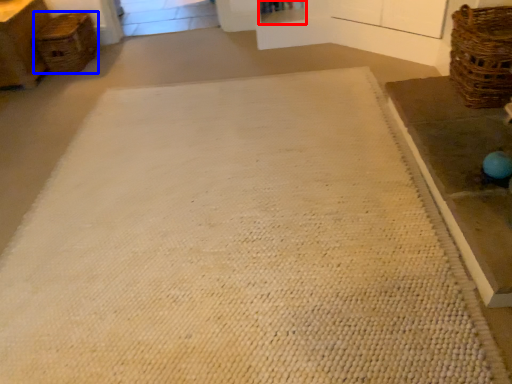
Question: Which object is further to the camera taking this photo, shelf (highlighted by a red box) or basket (highlighted by a blue box)?

Choices:
 (A) shelf
 (B) basket

Answer: (A)